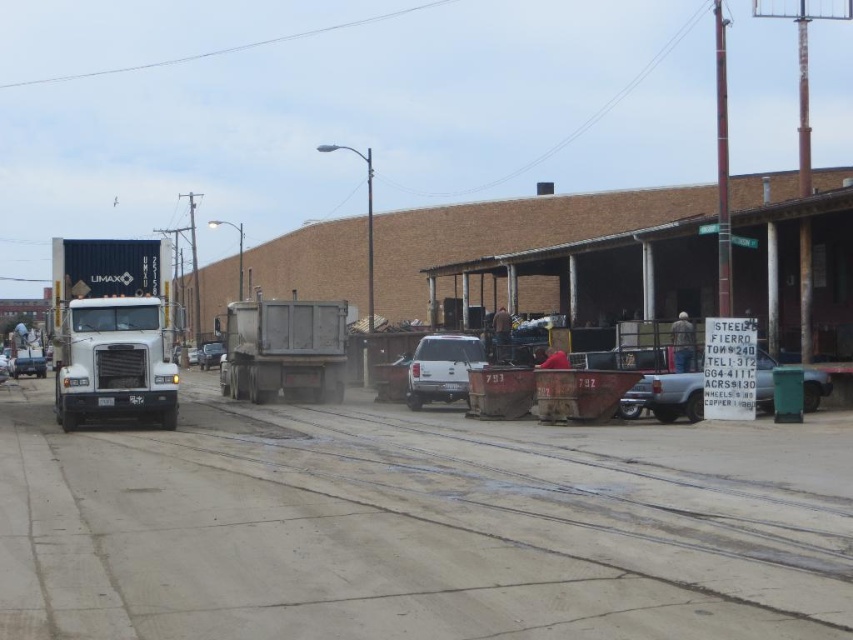
Question: Is metallic silver car at left wider than metallic silver sedan at center?

Choices:
 (A) no
 (B) yes

Answer: (B)

Question: Is gray metallic trailer truck at center positioned behind white matte truck at center?

Choices:
 (A) yes
 (B) no

Answer: (A)

Question: Which object appears farthest from the camera in this image?

Choices:
 (A) metallic silver car at left
 (B) white matte truck at left
 (C) white matte truck at center

Answer: (A)

Question: Can you confirm if metallic silver car at left is positioned above metallic silver sedan at center?

Choices:
 (A) no
 (B) yes

Answer: (A)

Question: Which of the following is the farthest from the observer?

Choices:
 (A) dirt track at center
 (B) matte gray truck at center
 (C) metallic silver car at left
 (D) gray metallic trailer truck at center

Answer: (C)

Question: Which point is farther to the camera?

Choices:
 (A) metallic silver car at left
 (B) gray metallic trailer truck at center

Answer: (A)